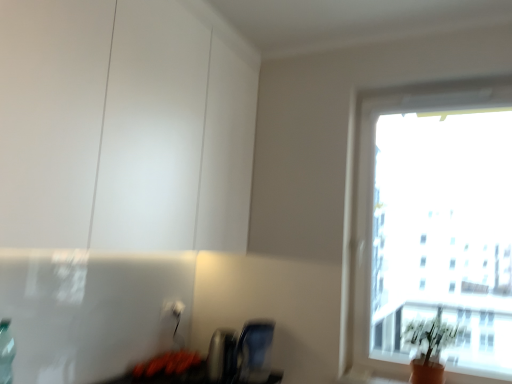
Question: From the image's perspective, is transparent glass window at upper right over green matte plant at lower right?

Choices:
 (A) no
 (B) yes

Answer: (B)

Question: Are transparent glass window at upper right and green matte plant at lower right far apart?

Choices:
 (A) yes
 (B) no

Answer: (A)

Question: From a real-world perspective, does transparent glass window at upper right sit lower than green matte plant at lower right?

Choices:
 (A) no
 (B) yes

Answer: (A)

Question: Is transparent glass window at upper right positioned with its back to green matte plant at lower right?

Choices:
 (A) yes
 (B) no

Answer: (A)

Question: Considering the relative sizes of transparent glass window at upper right and green matte plant at lower right in the image provided, is transparent glass window at upper right shorter than green matte plant at lower right?

Choices:
 (A) no
 (B) yes

Answer: (A)

Question: Considering the relative sizes of transparent glass window at upper right and green matte plant at lower right in the image provided, is transparent glass window at upper right thinner than green matte plant at lower right?

Choices:
 (A) yes
 (B) no

Answer: (B)

Question: Does green matte plant at lower right have a smaller size compared to matte white cabinet at upper left?

Choices:
 (A) no
 (B) yes

Answer: (B)

Question: Considering the relative sizes of green matte plant at lower right and matte white cabinet at upper left in the image provided, is green matte plant at lower right shorter than matte white cabinet at upper left?

Choices:
 (A) no
 (B) yes

Answer: (B)

Question: Is green matte plant at lower right positioned before matte white cabinet at upper left?

Choices:
 (A) no
 (B) yes

Answer: (A)

Question: Considering the relative sizes of green matte plant at lower right and matte white cabinet at upper left in the image provided, is green matte plant at lower right thinner than matte white cabinet at upper left?

Choices:
 (A) yes
 (B) no

Answer: (A)

Question: From the image's perspective, does green matte plant at lower right appear lower than matte white cabinet at upper left?

Choices:
 (A) no
 (B) yes

Answer: (B)

Question: Is green matte plant at lower right further to the viewer compared to matte white cabinet at upper left?

Choices:
 (A) yes
 (B) no

Answer: (A)

Question: Does white plastic electric outlet at lower center, the 1th electric outlet in the right-to-left sequence, appear on the left side of matte white cabinet at upper left?

Choices:
 (A) yes
 (B) no

Answer: (B)